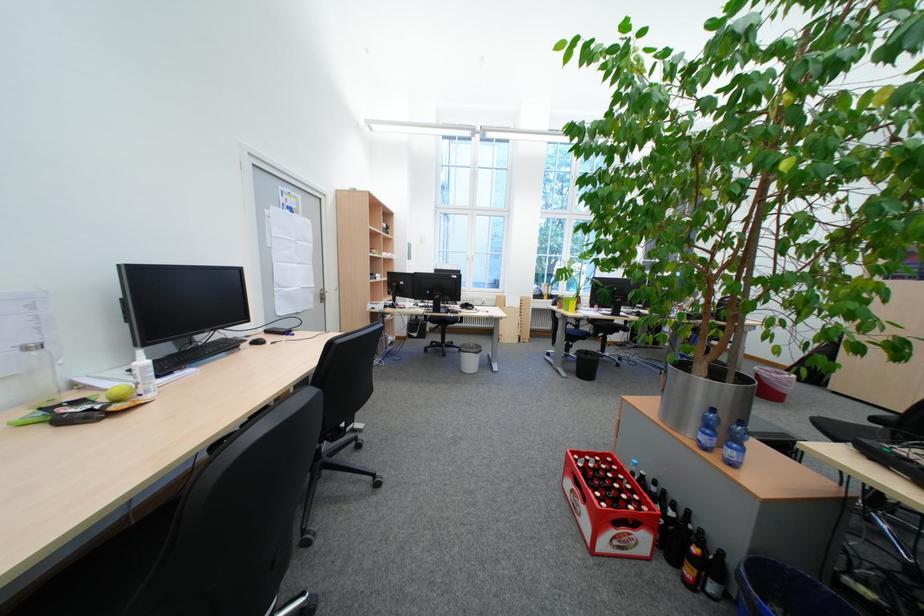
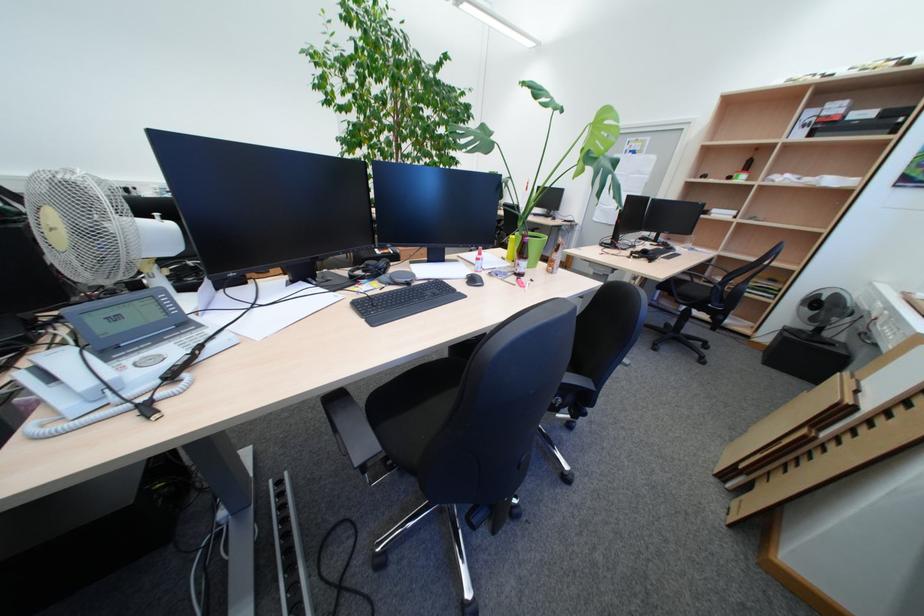
Question: I am providing you with two images of the same scene from different viewpoints. Please identify which objects are invisible in image2.

Choices:
 (A) black chair armrest
 (B) telephone handset
 (C) brown glass bottle
 (D) red tin lid

Answer: (C)